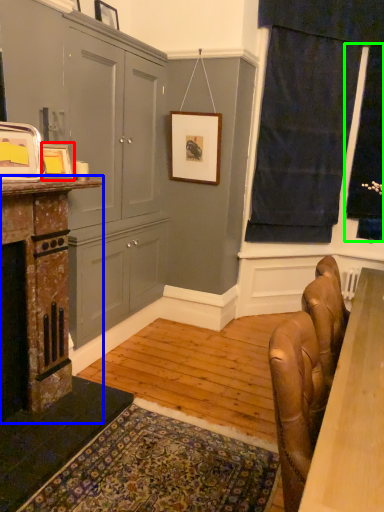
Question: Which is nearer to the picture frame (highlighted by a red box)? fireplace (highlighted by a blue box) or window screen (highlighted by a green box).

Choices:
 (A) fireplace
 (B) window screen

Answer: (A)